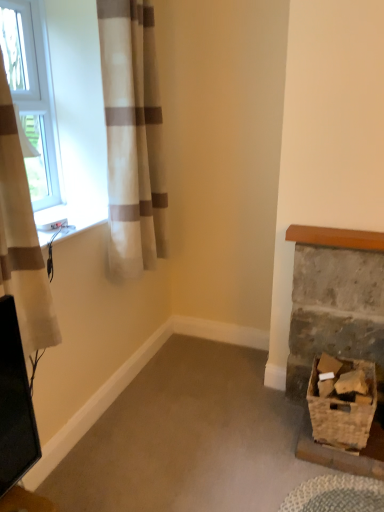
At what (x,y) coordinates should I click in order to perform the action: click on white textured curtain at left, the second curtain when ordered from back to front. Please return your answer as a coordinate pair (x, y). Looking at the image, I should click on (21, 238).

Locate an element on the screen. woven brown basket at lower right is located at coordinates (342, 411).

From a real-world perspective, which is physically below, white textured curtain at left, acting as the 1th curtain starting from the left, or rustic wooden basket at lower right?

rustic wooden basket at lower right, from a real-world perspective.

Consider the image. Is white textured curtain at left, marked as the first curtain in a front-to-back arrangement, far from rustic wooden basket at lower right?

Yes, white textured curtain at left, marked as the first curtain in a front-to-back arrangement, is far from rustic wooden basket at lower right.

Based on the photo, how much distance is there between white textured curtain at left, the second curtain when ordered from right to left, and rustic wooden basket at lower right?

The distance of white textured curtain at left, the second curtain when ordered from right to left, from rustic wooden basket at lower right is 1.28 meters.

Is rustic wooden basket at lower right located within white textured curtain at left, acting as the 1th curtain starting from the left?

That's incorrect, rustic wooden basket at lower right is not inside white textured curtain at left, acting as the 1th curtain starting from the left.

Is woven brown basket at lower right far from white textured curtain at left, the second curtain when ordered from right to left?

Indeed, woven brown basket at lower right is not near white textured curtain at left, the second curtain when ordered from right to left.

From a real-world perspective, between woven brown basket at lower right and white textured curtain at left, the second curtain when ordered from back to front, who is vertically lower?

In real-world perspective, woven brown basket at lower right is lower.

Can you confirm if woven brown basket at lower right is thinner than white textured curtain at left, the second curtain when ordered from right to left?

In fact, woven brown basket at lower right might be wider than white textured curtain at left, the second curtain when ordered from right to left.

From the image's perspective, is white sheer curtain at left, the 2th curtain when ordered from left to right, above or below rustic wooden basket at lower right?

white sheer curtain at left, the 2th curtain when ordered from left to right, is above rustic wooden basket at lower right.

Consider the image. How much distance is there between white sheer curtain at left, the 2th curtain when ordered from left to right, and rustic wooden basket at lower right?

white sheer curtain at left, the 2th curtain when ordered from left to right, and rustic wooden basket at lower right are 35.93 inches apart.

Is point (141, 9) positioned before point (316, 340)?

Yes, it is in front of point (316, 340).

Does white sheer curtain at left, the first curtain positioned from the right, come behind rustic wooden basket at lower right?

No, it is in front of rustic wooden basket at lower right.

Considering the sizes of objects white plastic window at upper left and rustic wooden basket at lower right in the image provided, who is smaller, white plastic window at upper left or rustic wooden basket at lower right?

white plastic window at upper left.

Could rustic wooden basket at lower right be considered to be inside white plastic window at upper left?

No, rustic wooden basket at lower right is not surrounded by white plastic window at upper left.

From a real-world perspective, relative to rustic wooden basket at lower right, is white plastic window at upper left vertically above or below?

white plastic window at upper left is above rustic wooden basket at lower right.

In order to click on window lying in front of the rustic wooden basket at lower right in this screenshot , I will do `click(77, 114)`.

Could you tell me if white plastic window at upper left is facing woven brown basket at lower right?

Yes.

The width and height of the screenshot is (384, 512). Find the location of `basket below the white plastic window at upper left (from the image's perspective)`. basket below the white plastic window at upper left (from the image's perspective) is located at coordinates (342, 411).

From a real-world perspective, is white plastic window at upper left positioned under woven brown basket at lower right based on gravity?

No, from a real-world perspective, white plastic window at upper left is not below woven brown basket at lower right.

Considering the positions of points (37, 85) and (311, 402), is point (37, 85) farther from camera compared to point (311, 402)?

Yes, it is behind point (311, 402).

In the scene shown: From the image's perspective, which is below, white sheer curtain at left, the 2th curtain when ordered from left to right, or white textured curtain at left, the second curtain when ordered from right to left?

white textured curtain at left, the second curtain when ordered from right to left.

Is white sheer curtain at left, the 2th curtain when ordered from left to right, smaller than white textured curtain at left, acting as the 1th curtain starting from the left?

No.

Can you confirm if white sheer curtain at left, which ranks as the 2th curtain in front-to-back order, is shorter than white textured curtain at left, the second curtain when ordered from back to front?

In fact, white sheer curtain at left, which ranks as the 2th curtain in front-to-back order, may be taller than white textured curtain at left, the second curtain when ordered from back to front.

Is white sheer curtain at left, which ranks as the 2th curtain in front-to-back order, to the right of white textured curtain at left, acting as the 1th curtain starting from the left, from the viewer's perspective?

Indeed, white sheer curtain at left, which ranks as the 2th curtain in front-to-back order, is positioned on the right side of white textured curtain at left, acting as the 1th curtain starting from the left.

Considering their positions, is white textured curtain at left, acting as the 1th curtain starting from the left, located in front of or behind white sheer curtain at left, the first curtain from the back?

white textured curtain at left, acting as the 1th curtain starting from the left, is in front of white sheer curtain at left, the first curtain from the back.

Between white textured curtain at left, the second curtain when ordered from back to front, and white sheer curtain at left, the first curtain from the back, which one appears on the left side from the viewer's perspective?

Positioned to the left is white textured curtain at left, the second curtain when ordered from back to front.

Considering the points (29, 224) and (118, 29), which point is behind, point (29, 224) or point (118, 29)?

The point (118, 29) is farther.

Is white textured curtain at left, acting as the 1th curtain starting from the left, in contact with white sheer curtain at left, which ranks as the 2th curtain in front-to-back order?

white textured curtain at left, acting as the 1th curtain starting from the left, is not next to white sheer curtain at left, which ranks as the 2th curtain in front-to-back order, and they're not touching.

Find the location of `curtain that is the 2nd one when counting forward from the rustic wooden basket at lower right`. curtain that is the 2nd one when counting forward from the rustic wooden basket at lower right is located at coordinates (21, 238).

This screenshot has height=512, width=384. In order to click on the 1st curtain above the woven brown basket at lower right (from the image's perspective) in this screenshot , I will do `click(21, 238)`.

When comparing their distances from woven brown basket at lower right, does white plastic window at upper left or white sheer curtain at left, the first curtain from the back, seem further?

white plastic window at upper left lies further to woven brown basket at lower right than the other object.

In the scene shown: Based on their spatial positions, is white plastic window at upper left or white sheer curtain at left, which ranks as the 2th curtain in front-to-back order, further from rustic wooden basket at lower right?

white plastic window at upper left lies further to rustic wooden basket at lower right than the other object.

Estimate the real-world distances between objects in this image. Which object is closer to white plastic window at upper left, rustic wooden basket at lower right or woven brown basket at lower right?

rustic wooden basket at lower right.

Looking at the image, which one is located further to rustic wooden basket at lower right, white textured curtain at left, the second curtain when ordered from back to front, or white plastic window at upper left?

Based on the image, white textured curtain at left, the second curtain when ordered from back to front, appears to be further to rustic wooden basket at lower right.

Considering their positions, is white sheer curtain at left, which ranks as the 2th curtain in front-to-back order, positioned closer to white textured curtain at left, acting as the 1th curtain starting from the left, than white plastic window at upper left?

white sheer curtain at left, which ranks as the 2th curtain in front-to-back order.

Looking at the image, which one is located further to white sheer curtain at left, the first curtain from the back, woven brown basket at lower right or white textured curtain at left, marked as the first curtain in a front-to-back arrangement?

woven brown basket at lower right.

Looking at the image, which one is located further to rustic wooden basket at lower right, white sheer curtain at left, the 2th curtain when ordered from left to right, or white textured curtain at left, acting as the 1th curtain starting from the left?

white textured curtain at left, acting as the 1th curtain starting from the left, is positioned further to the anchor rustic wooden basket at lower right.

Considering their positions, is woven brown basket at lower right positioned closer to white textured curtain at left, the second curtain when ordered from right to left, than rustic wooden basket at lower right?

rustic wooden basket at lower right lies closer to white textured curtain at left, the second curtain when ordered from right to left, than the other object.

Find the location of a particular element. The width and height of the screenshot is (384, 512). basket between white plastic window at upper left and rustic wooden basket at lower right in the horizontal direction is located at coordinates (342, 411).

The image size is (384, 512). I want to click on basket between white textured curtain at left, marked as the first curtain in a front-to-back arrangement, and rustic wooden basket at lower right from left to right, so click(x=342, y=411).

Find the location of a particular element. The width and height of the screenshot is (384, 512). curtain positioned between white textured curtain at left, the second curtain when ordered from right to left, and white plastic window at upper left from near to far is located at coordinates (133, 137).

The height and width of the screenshot is (512, 384). What are the coordinates of `curtain situated between white textured curtain at left, the second curtain when ordered from back to front, and woven brown basket at lower right from left to right` in the screenshot? It's located at (133, 137).